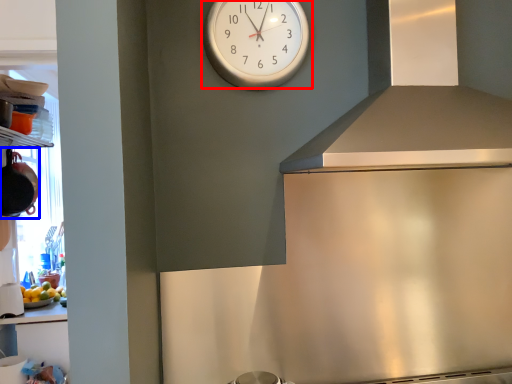
Question: Which point is further to the camera, wall clock (highlighted by a red box) or appliance (highlighted by a blue box)?

Choices:
 (A) wall clock
 (B) appliance

Answer: (B)